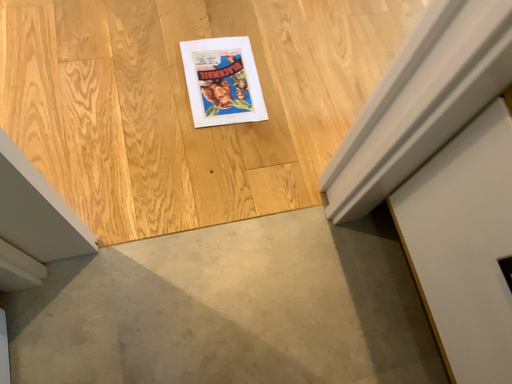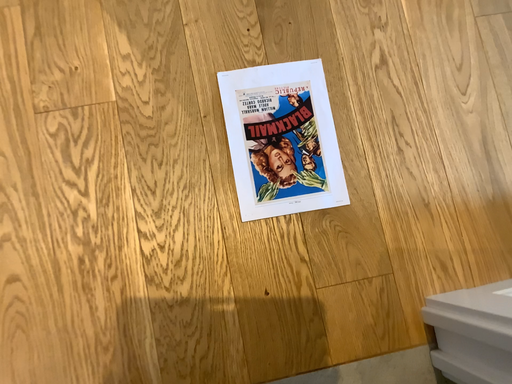
Question: Which way did the camera rotate in the video?

Choices:
 (A) rotated upward
 (B) rotated downward

Answer: (B)